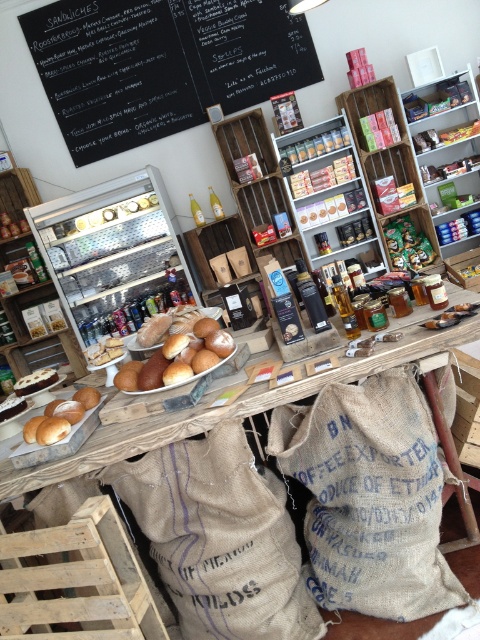
You are a customer standing at the entrance of the deli and want to reach both the counter with baked goods and the shelves with products. You notice two points marked in the image. The first point is at coordinate point(285, 16) and the second is at point(314, 147). Which point is closer to you as you stand at the entrance?

Point(285, 16) is closer to you than point(314, 147) because it is further to the viewer in the image.

You are a customer at the deli and want to read the menu written on the black chalkboard at upper center. However, there is a burlap sack at lower center in your way. Can you see the entire chalkboard without moving the sack?

The black chalkboard at upper center is taller than the burlap sack at lower center, so you can see the top part of the chalkboard above the sack. However, the lower portion of the chalkboard might be partially obscured by the sack depending on their positions.

You are a customer in the deli who wants to grab both the burlap sack at center and the white cake at center. Can you reach both items without moving your position?

The distance between the burlap sack at center and the white cake at center is 1.37 meters. Since the items are more than an arm length apart, you cannot reach both without moving.